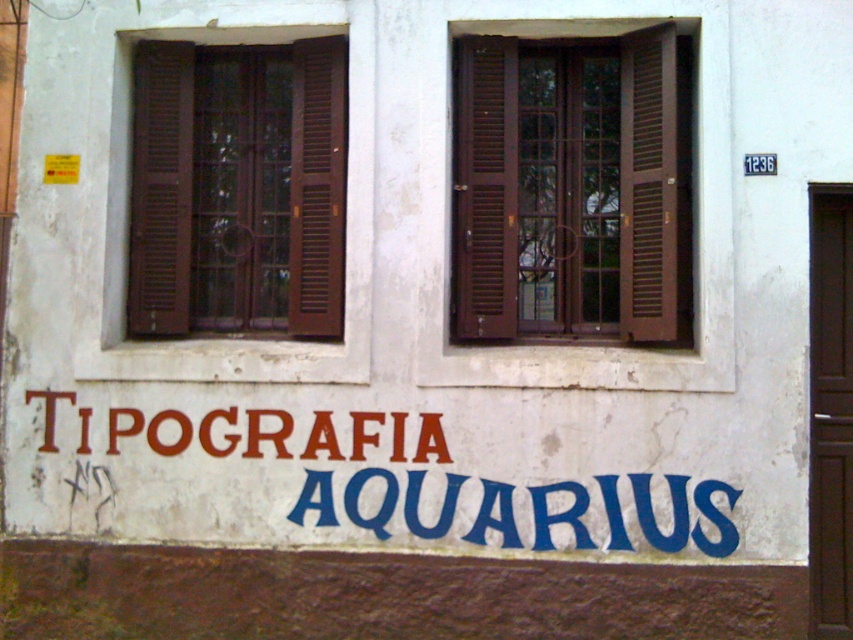
Is brown wooden window at left thinner than red paint sign at center?

Correct, brown wooden window at left's width is less than red paint sign at center's.

Measure the distance between point (273, 184) and camera.

Point (273, 184) is 7.09 meters away from camera.

In order to click on brown wooden window at left in this screenshot , I will do `click(236, 188)`.

Is the position of brown wooden window at upper center more distant than that of red paint sign at center?

Yes, it is.

Between point (677, 301) and point (654, 486), which one is positioned behind?

The point (677, 301) is behind.

The image size is (853, 640). What are the coordinates of `brown wooden window at upper center` in the screenshot? It's located at (572, 188).

This screenshot has height=640, width=853. Describe the element at coordinates (572, 188) in the screenshot. I see `brown wooden window at upper center` at that location.

Between brown wooden window at upper center and brown wooden window at left, which one is positioned lower?

brown wooden window at upper center is below.

Is point (570, 259) behind point (206, 289)?

That is False.

Locate an element on the screen. The image size is (853, 640). brown wooden window at upper center is located at coordinates (572, 188).